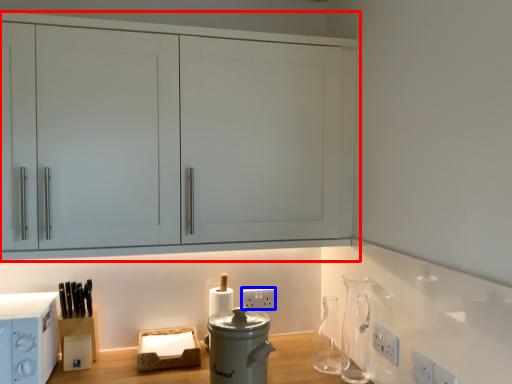
Question: Which of the following is the farthest to the observer, cabinetry (highlighted by a red box) or electric outlet (highlighted by a blue box)?

Choices:
 (A) cabinetry
 (B) electric outlet

Answer: (B)